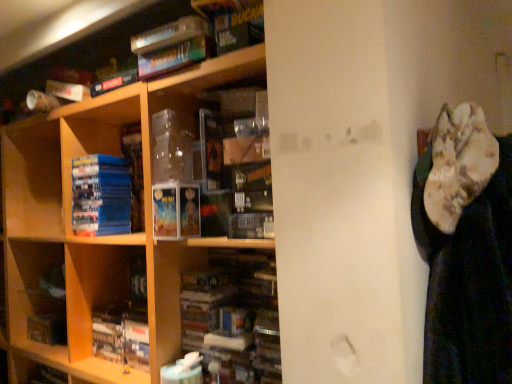
Question: Considering the relative positions of wooden shelf at center and hardcover book at center, acting as the 1th book starting from the bottom, in the image provided, is wooden shelf at center to the left of hardcover book at center, acting as the 1th book starting from the bottom, from the viewer's perspective?

Choices:
 (A) yes
 (B) no

Answer: (A)

Question: Does wooden shelf at center appear on the right side of hardcover book at center, acting as the 1th book starting from the bottom?

Choices:
 (A) no
 (B) yes

Answer: (A)

Question: Is wooden shelf at center oriented away from hardcover book at center, placed as the 2th book when sorted from top to bottom?

Choices:
 (A) yes
 (B) no

Answer: (A)

Question: Are wooden shelf at center and hardcover book at center, acting as the 1th book starting from the bottom, located far from each other?

Choices:
 (A) yes
 (B) no

Answer: (B)

Question: Does wooden shelf at center have a lesser height compared to hardcover book at center, placed as the 2th book when sorted from top to bottom?

Choices:
 (A) no
 (B) yes

Answer: (A)

Question: Which is correct: matte paperbacks at center is inside wooden shelf at center, or outside of it?

Choices:
 (A) outside
 (B) inside

Answer: (B)

Question: Does point (189, 236) appear closer or farther from the camera than point (64, 215)?

Choices:
 (A) closer
 (B) farther

Answer: (A)

Question: In the image, is matte paperbacks at center positioned in front of or behind wooden shelf at center?

Choices:
 (A) front
 (B) behind

Answer: (B)

Question: From a real-world perspective, is matte paperbacks at center above or below wooden shelf at center?

Choices:
 (A) below
 (B) above

Answer: (B)

Question: Is wooden shelf at center wider or thinner than hardcover book at center, acting as the 1th book starting from the bottom?

Choices:
 (A) wide
 (B) thin

Answer: (A)

Question: Is wooden shelf at center inside or outside of hardcover book at center, placed as the 2th book when sorted from top to bottom?

Choices:
 (A) inside
 (B) outside

Answer: (B)

Question: From a real-world perspective, is wooden shelf at center physically located above or below hardcover book at center, acting as the 1th book starting from the bottom?

Choices:
 (A) above
 (B) below

Answer: (A)

Question: Visually, is wooden shelf at center positioned to the left or to the right of hardcover book at center, placed as the 2th book when sorted from top to bottom?

Choices:
 (A) left
 (B) right

Answer: (A)

Question: Considering the relative positions of matte paperbacks at center and blue matte book at left, marked as the 2th book in a bottom-to-top arrangement, in the image provided, is matte paperbacks at center to the left or to the right of blue matte book at left, marked as the 2th book in a bottom-to-top arrangement,?

Choices:
 (A) left
 (B) right

Answer: (B)

Question: Choose the correct answer: Is matte paperbacks at center inside blue matte book at left, marked as the 2th book in a bottom-to-top arrangement, or outside it?

Choices:
 (A) inside
 (B) outside

Answer: (B)